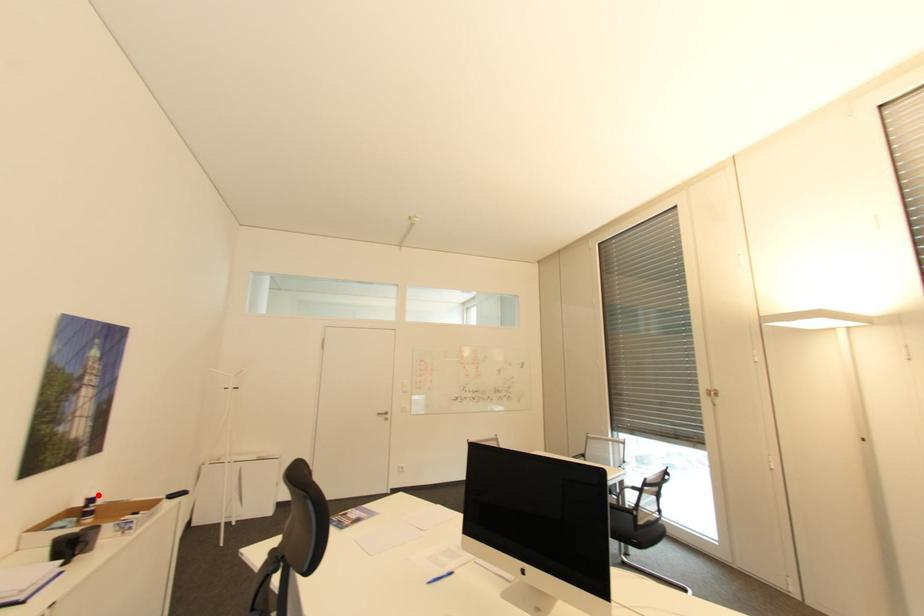
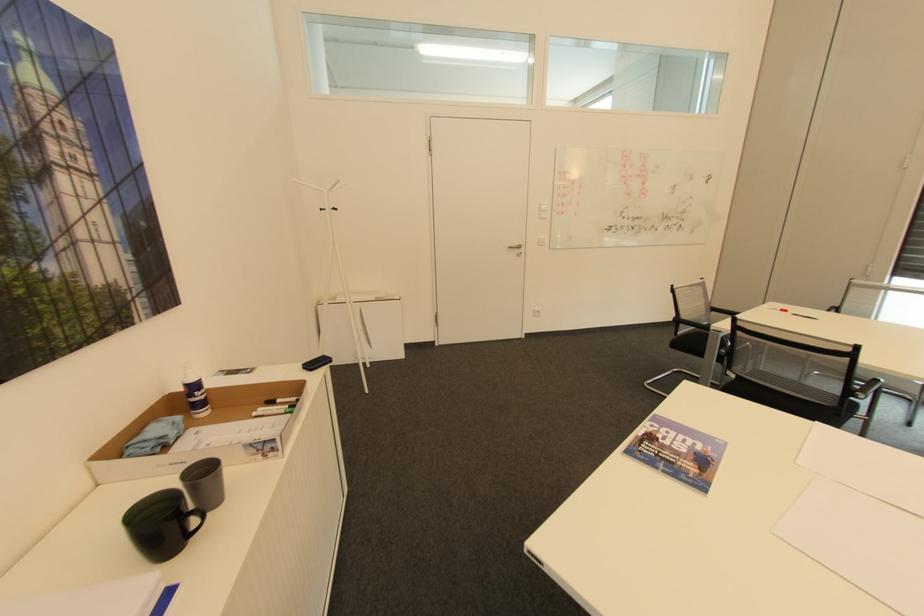
In the second image, find the point that corresponds to the highlighted location in the first image.

(197, 379)